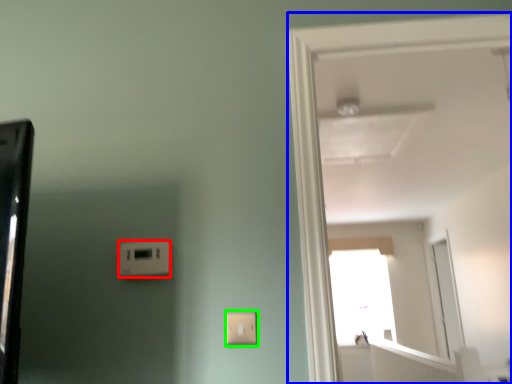
Question: Which object is the farthest from light switch (highlighted by a red box)? Choose among these: door (highlighted by a blue box) or light switch (highlighted by a green box).

Choices:
 (A) door
 (B) light switch

Answer: (A)